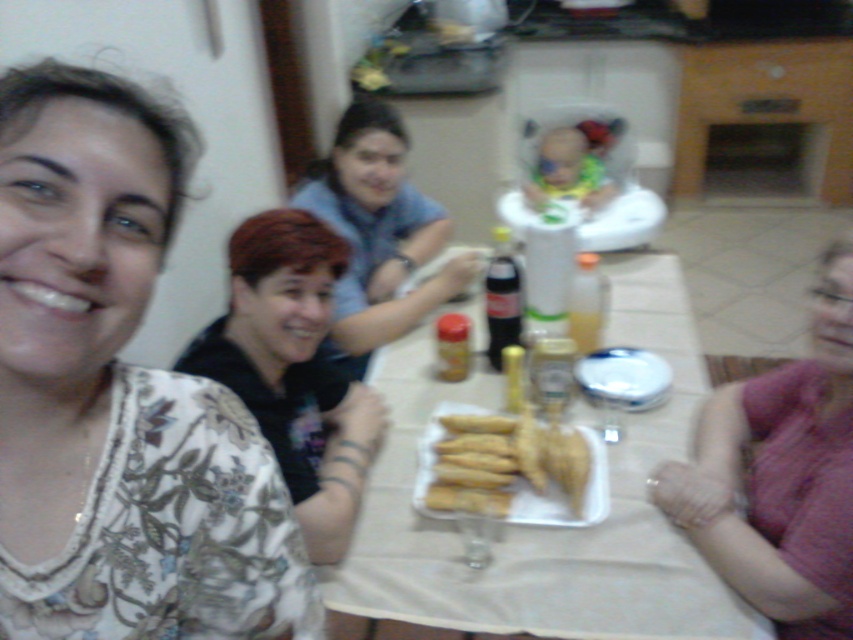
Question: Which object is farther from the camera taking this photo?

Choices:
 (A) pink fabric at lower right
 (B) matte blue shirt at center
 (C) white glossy plate at center
 (D) golden crispy pastry at center

Answer: (B)

Question: Which point is farther from the camera taking this photo?

Choices:
 (A) (583, 378)
 (B) (544, 484)

Answer: (A)

Question: Does white paper tray at center have a greater width compared to pink fabric at lower right?

Choices:
 (A) no
 (B) yes

Answer: (B)

Question: Is matte blue shirt at center above golden crispy pastry at center?

Choices:
 (A) yes
 (B) no

Answer: (A)

Question: Considering the real-world distances, which object is closest to the pink fabric at lower right?

Choices:
 (A) white glossy plate at center
 (B) matte blue shirt at center
 (C) floral print blouse at left

Answer: (A)

Question: Does white paper tray at center appear over pink fabric at lower right?

Choices:
 (A) no
 (B) yes

Answer: (B)